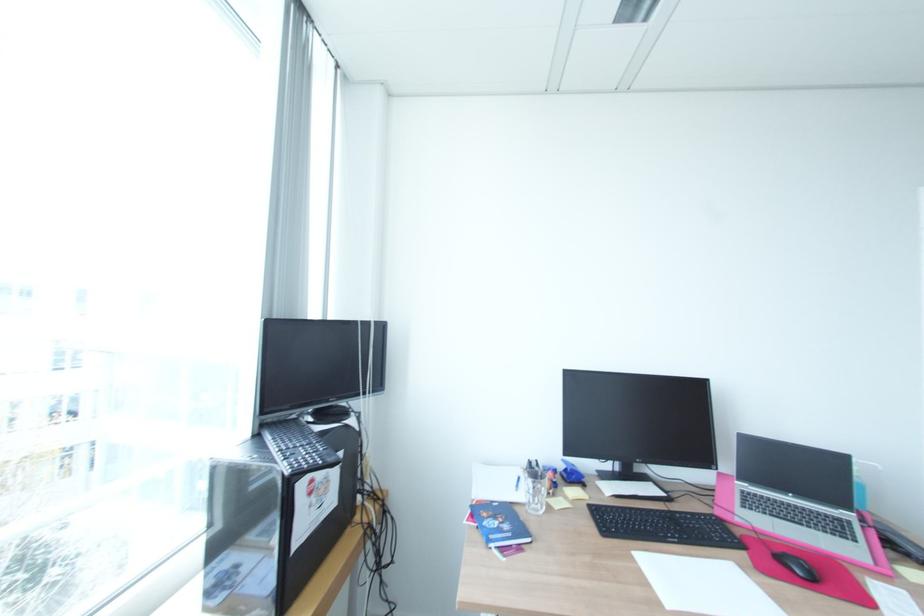
The image size is (924, 616). What do you see at coordinates (373, 471) in the screenshot?
I see `the white beaded chain` at bounding box center [373, 471].